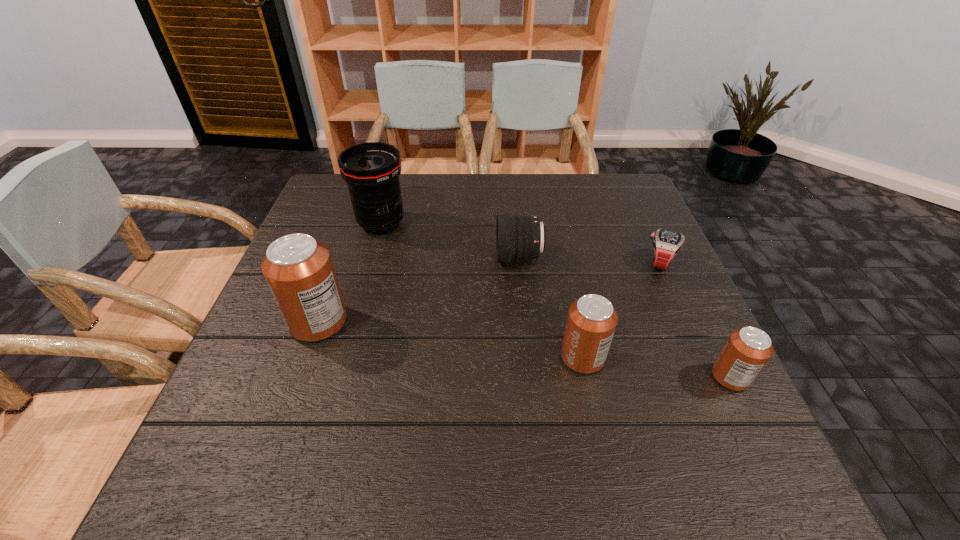
Please point a space for a new can to maintain equal intervals. Please provide its 2D coordinates. Your answer should be formatted as a tuple, i.e. [(x, y)], where the tuple contains the x and y coordinates of a point satisfying the conditions above.

[(445, 339)]